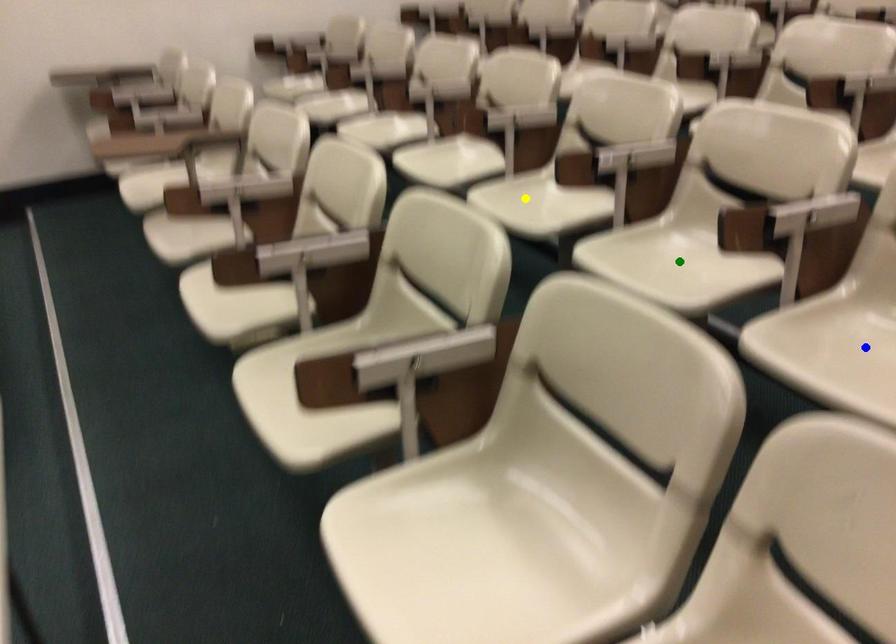
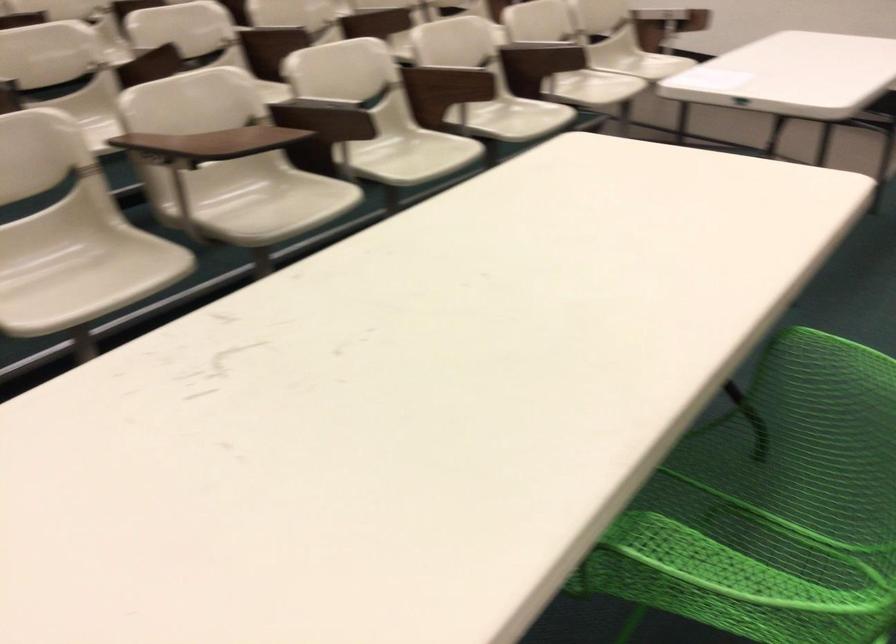
I am providing you with two images of the same scene from different viewpoints. Three points are marked in image1. Which point corresponds to a part or object that is occluded in image2?In image1, three points are marked. Which of them correspond to a part or object that is occluded in image2?Among the three points shown in image1, which one corresponds to a part or object that is no longer visible due to occlusion in image2?

blue point, yellow point, green point cannot be seen in image2.